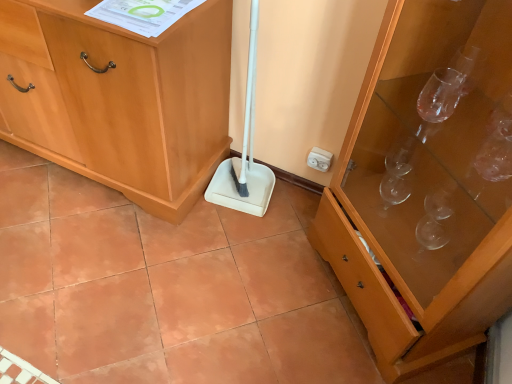
The height and width of the screenshot is (384, 512). I want to click on vacant area on top of terracotta ceramic tile at center (from a real-world perspective), so click(176, 273).